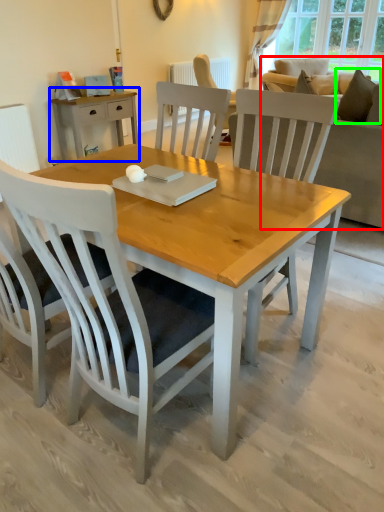
Question: Which object is the farthest from studio couch (highlighted by a red box)? Choose among these: desk (highlighted by a blue box) or pillow (highlighted by a green box).

Choices:
 (A) desk
 (B) pillow

Answer: (A)